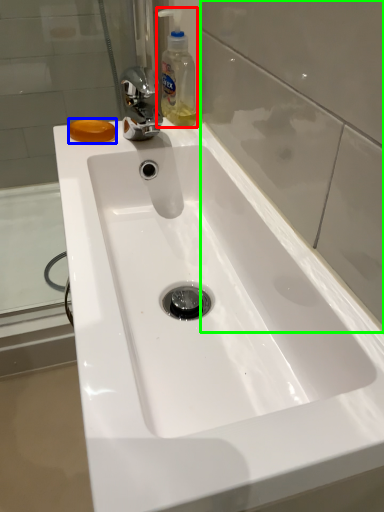
Question: Based on their relative distances, which object is farther from cleaning product (highlighted by a red box)? Choose from soap (highlighted by a blue box) and glass door (highlighted by a green box).

Choices:
 (A) soap
 (B) glass door

Answer: (B)